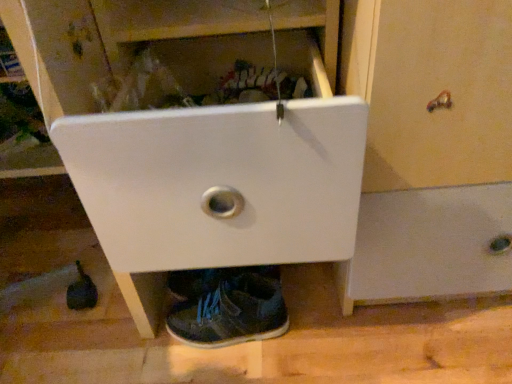
Locate an element on the screen. This screenshot has width=512, height=384. dark blue canvas shoe at lower center is located at coordinates pyautogui.click(x=228, y=308).

The height and width of the screenshot is (384, 512). What do you see at coordinates (228, 308) in the screenshot?
I see `dark blue canvas shoe at lower center` at bounding box center [228, 308].

Image resolution: width=512 pixels, height=384 pixels. Identify the location of dark blue canvas shoe at lower center. (228, 308).